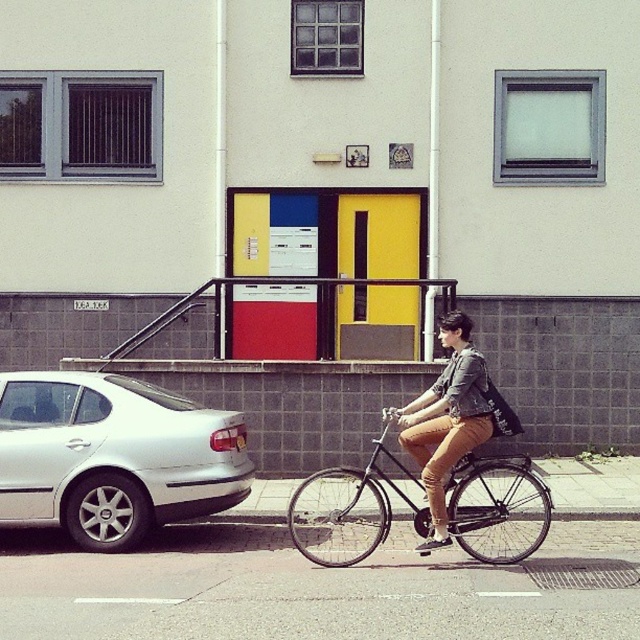
How distant is silver metallic car at left from denim jacket at center?

A distance of 7.93 feet exists between silver metallic car at left and denim jacket at center.

Which is below, silver metallic car at left or denim jacket at center?

silver metallic car at left is below.

What do you see at coordinates (113, 456) in the screenshot? The width and height of the screenshot is (640, 640). I see `silver metallic car at left` at bounding box center [113, 456].

You are a GUI agent. You are given a task and a screenshot of the screen. Output one action in this format:
    pyautogui.click(x=<x>, y=<y>)
    Task: Click on the silver metallic car at left
    Image resolution: width=640 pixels, height=640 pixels.
    Given the screenshot: What is the action you would take?
    pyautogui.click(x=113, y=456)

Between point (0, 445) and point (468, 545), which one is positioned behind?

The point (468, 545) is more distant.

Which is more to the left, silver metallic car at left or shiny black bicycle at center?

Positioned to the left is silver metallic car at left.

Which is in front, point (224, 472) or point (348, 513)?

Point (224, 472)

The width and height of the screenshot is (640, 640). In order to click on silver metallic car at left in this screenshot , I will do `click(113, 456)`.

Between shiny black bicycle at center and denim jacket at center, which one is positioned lower?

shiny black bicycle at center is below.

Is shiny black bicycle at center above denim jacket at center?

No.

Which is in front, point (502, 561) or point (417, 428)?

Point (502, 561) is more forward.

This screenshot has width=640, height=640. What are the coordinates of `shiny black bicycle at center` in the screenshot? It's located at (353, 506).